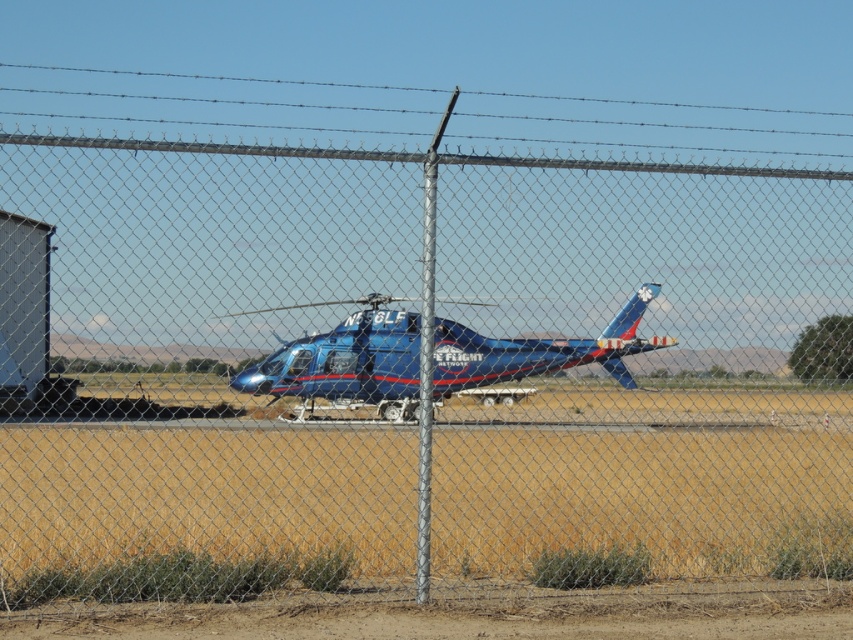
How much distance is there between blue glossy helicopter at center and metallic blue trailer truck at left?

blue glossy helicopter at center and metallic blue trailer truck at left are 7.72 meters apart.

Is point (376, 326) in front of point (22, 371)?

Yes, it is.

I want to click on blue glossy helicopter at center, so click(347, 364).